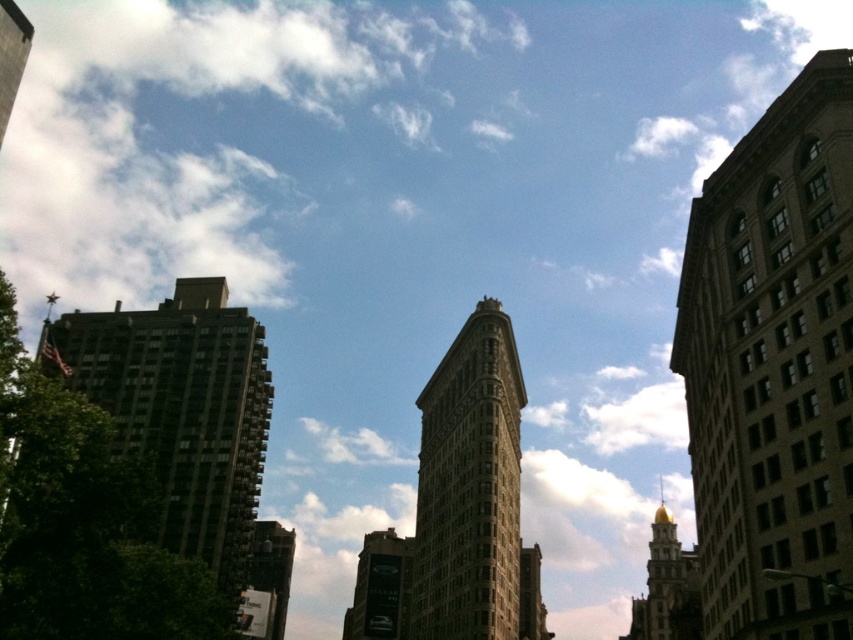
You are an architect analyzing the cityscape. You notice the brown brick building at right and the brown stone building at center. Based on their positions, which one is higher in the image?

The brown brick building at right is above the brown stone building at center, so it appears higher in the image.

You are a city planner assessing the space between two buildings in the image. The brown brick building at right and the brown stone building at center are part of your study. Given that the minimum required distance for emergency vehicles to pass between them is 90 feet, can the current spacing accommodate this requirement?

The brown brick building at right and the brown stone building at center are 92.18 feet apart from each other, which exceeds the 90 feet requirement. Therefore, emergency vehicles can safely pass between them.